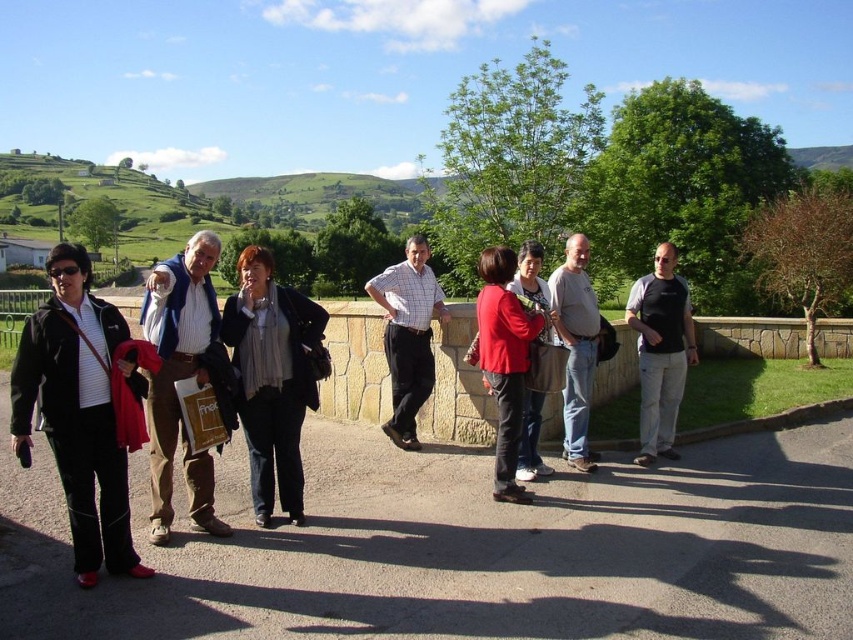
Question: Is matte red jacket at center positioned at the back of gray cotton shirt at center?

Choices:
 (A) yes
 (B) no

Answer: (B)

Question: Is matte blue jacket at left closer to the viewer compared to matte red sweater at center?

Choices:
 (A) no
 (B) yes

Answer: (B)

Question: Does black matte jacket at center have a greater width compared to gray cotton shirt at center?

Choices:
 (A) yes
 (B) no

Answer: (B)

Question: Among these points, which one is farthest from the camera?

Choices:
 (A) 500,282
 (B) 413,344
 (C) 654,346
 (D) 566,310

Answer: (B)

Question: Which point is farther to the camera?

Choices:
 (A) matte blue jacket at left
 (B) black matte jacket at center
 (C) black matte shirt at center

Answer: (C)

Question: Which of the following is the farthest from the observer?

Choices:
 (A) (505, 252)
 (B) (660, 420)
 (C) (316, 337)
 (D) (479, 637)

Answer: (B)